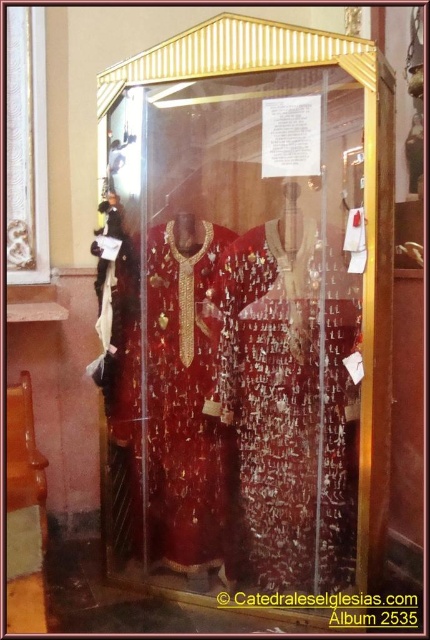
Looking at this image, can you confirm if transparent glass door at center is positioned to the right of black paper at center?

In fact, transparent glass door at center is to the left of black paper at center.

Locate an element on the screen. transparent glass door at center is located at coordinates (248, 326).

Who is more distant from viewer, (335, 397) or (280, 596)?

The point (280, 596) is behind.

Is shiny gold fabric robe at center to the left of black paper at center from the viewer's perspective?

Correct, you'll find shiny gold fabric robe at center to the left of black paper at center.

Between point (249, 289) and point (328, 616), which one is positioned behind?

The point (328, 616) is more distant.

The width and height of the screenshot is (430, 640). I want to click on shiny gold fabric robe at center, so click(x=283, y=416).

Can you confirm if transparent glass door at center is bigger than shiny gold fabric robe at center?

Yes.

Is transparent glass door at center above shiny gold fabric robe at center?

Yes, transparent glass door at center is above shiny gold fabric robe at center.

Is point (323, 371) more distant than point (313, 241)?

Yes, it is behind point (313, 241).

This screenshot has height=640, width=430. What are the coordinates of `transparent glass door at center` in the screenshot? It's located at (248, 326).